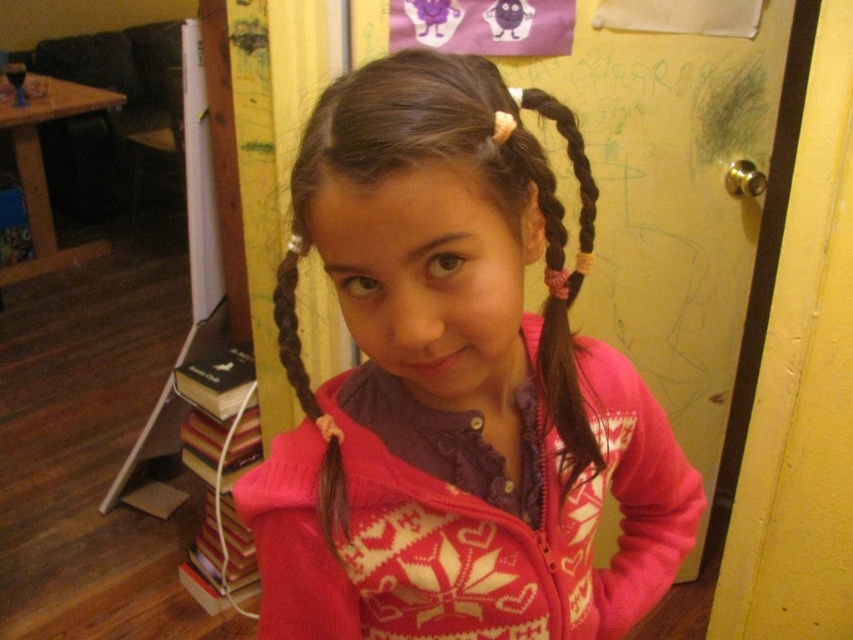
Question: Based on their relative distances, which object is nearer to the pink sweater at center?

Choices:
 (A) brown braided hair at left
 (B) brown silky hair at center

Answer: (B)

Question: Is pink sweater at center bigger than brown braided hair at left?

Choices:
 (A) yes
 (B) no

Answer: (A)

Question: Which is nearer to the pink sweater at center?

Choices:
 (A) brown braided hair at left
 (B) brown silky hair at center

Answer: (B)

Question: Is pink sweater at center positioned in front of brown silky hair at center?

Choices:
 (A) no
 (B) yes

Answer: (B)

Question: Which object is the farthest from the brown silky hair at center?

Choices:
 (A) pink sweater at center
 (B) brown braided hair at left

Answer: (B)

Question: Is brown silky hair at center closer to the viewer compared to brown braided hair at left?

Choices:
 (A) no
 (B) yes

Answer: (B)